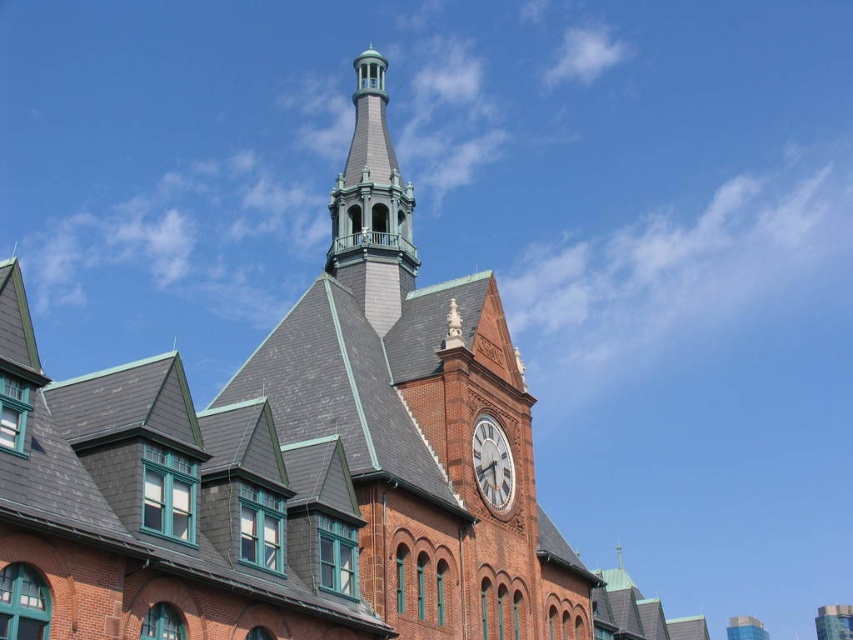
Question: Among these points, which one is nearest to the camera?

Choices:
 (A) (505, 504)
 (B) (381, 104)

Answer: (A)

Question: Which of the following is the farthest from the observer?

Choices:
 (A) red brick church at center
 (B) green copper bell tower at upper center

Answer: (B)

Question: Does red brick church at center have a lesser width compared to green copper bell tower at upper center?

Choices:
 (A) no
 (B) yes

Answer: (A)

Question: Is red brick church at center further to the viewer compared to green copper bell tower at upper center?

Choices:
 (A) yes
 (B) no

Answer: (B)

Question: Does red brick church at center have a lesser width compared to white metallic clock at upper center?

Choices:
 (A) yes
 (B) no

Answer: (B)

Question: Which of these objects is positioned farthest from the white metallic clock at upper center?

Choices:
 (A) red brick church at center
 (B) green copper bell tower at upper center

Answer: (B)